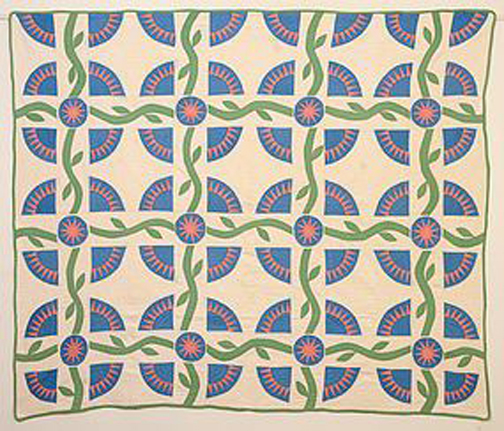
Identify the location of quilt. (500, 366).